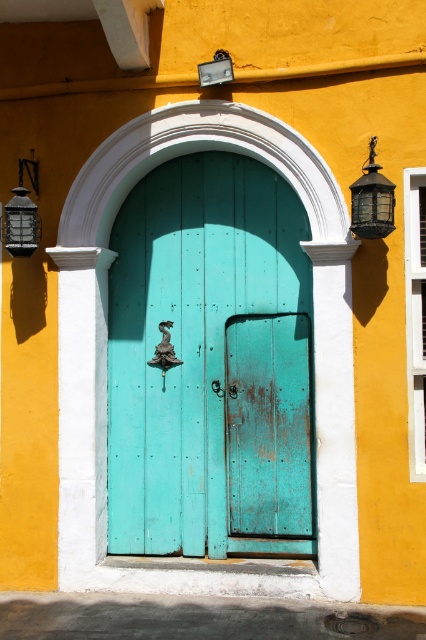
You are standing in front of the turquoise wooden door and notice two points marked on the door. One is at coordinate point (x=393, y=186) and the other at point (x=16, y=188). Which point is nearer to you when you face the door?

Point (x=393, y=186) is closer to the viewer than point (x=16, y=188).

You are a painter standing 2 meters away from the entrance. You want to paint the matte black lantern at left and the metallic glass at upper center. If the distance between them is 1.14 meters, will you be able to paint both objects without moving closer? Please explain your reasoning.

The distance between the matte black lantern at left and the metallic glass at upper center is 1.14 meters. Since you are standing 2 meters away from the entrance, the objects are within your painting range. Therefore, you can paint both objects without moving closer.